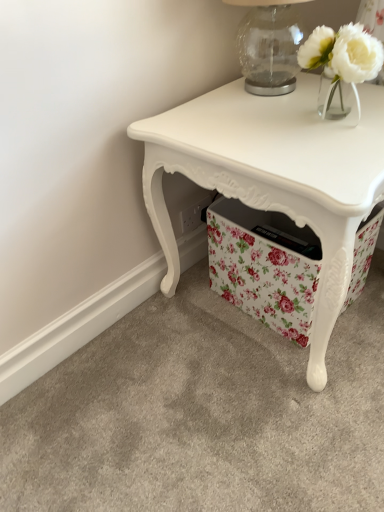
Question: Considering the relative sizes of transparent glass table lamp at upper right and floral fabric storage box at lower center in the image provided, is transparent glass table lamp at upper right taller than floral fabric storage box at lower center?

Choices:
 (A) yes
 (B) no

Answer: (B)

Question: From the image's perspective, would you say transparent glass table lamp at upper right is shown under floral fabric storage box at lower center?

Choices:
 (A) yes
 (B) no

Answer: (B)

Question: Could you tell me if transparent glass table lamp at upper right is turned towards floral fabric storage box at lower center?

Choices:
 (A) yes
 (B) no

Answer: (B)

Question: Is transparent glass table lamp at upper right outside of floral fabric storage box at lower center?

Choices:
 (A) no
 (B) yes

Answer: (B)

Question: Can you confirm if transparent glass table lamp at upper right is positioned to the left of floral fabric storage box at lower center?

Choices:
 (A) no
 (B) yes

Answer: (B)

Question: Can you confirm if transparent glass table lamp at upper right is positioned to the right of floral fabric storage box at lower center?

Choices:
 (A) yes
 (B) no

Answer: (B)

Question: Can we say floral fabric storage box at lower center lies outside transparent glass table lamp at upper right?

Choices:
 (A) yes
 (B) no

Answer: (A)

Question: Considering the relative sizes of floral fabric storage box at lower center and transparent glass table lamp at upper right in the image provided, is floral fabric storage box at lower center thinner than transparent glass table lamp at upper right?

Choices:
 (A) no
 (B) yes

Answer: (A)

Question: Is floral fabric storage box at lower center not near transparent glass table lamp at upper right?

Choices:
 (A) yes
 (B) no

Answer: (B)

Question: Does floral fabric storage box at lower center touch transparent glass table lamp at upper right?

Choices:
 (A) no
 (B) yes

Answer: (A)

Question: Considering the relative positions of floral fabric storage box at lower center and transparent glass table lamp at upper right in the image provided, is floral fabric storage box at lower center in front of transparent glass table lamp at upper right?

Choices:
 (A) yes
 (B) no

Answer: (B)

Question: From a real-world perspective, is floral fabric storage box at lower center located beneath transparent glass table lamp at upper right?

Choices:
 (A) no
 (B) yes

Answer: (B)

Question: Is white glossy table at center in front of transparent glass table lamp at upper right?

Choices:
 (A) no
 (B) yes

Answer: (B)